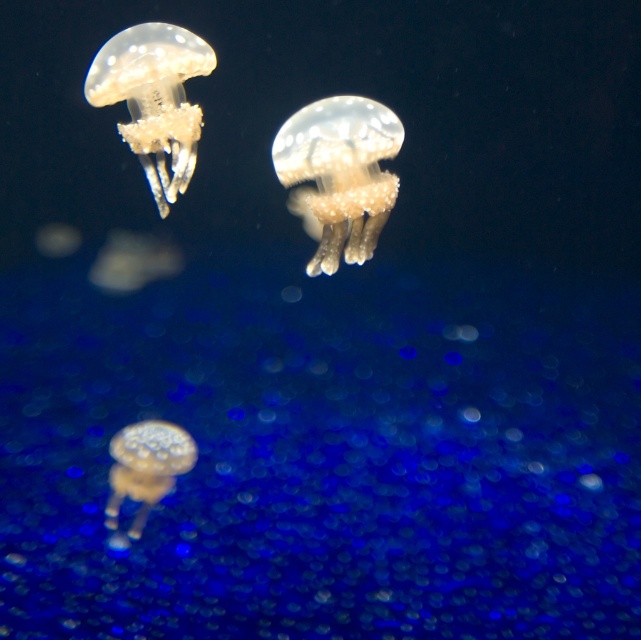
You are an underwater photographer aiming to capture the largest jellyfish in the scene. Given the translucent gelatinous at upper left and the translucent gelatinous at lower center, which one should you focus on?

The translucent gelatinous at upper left is larger in size compared to the translucent gelatinous at lower center, so you should focus on the translucent gelatinous at upper left to capture the largest jellyfish.

What are the exact coordinates of the translucent gelatinous at center in the image?

The translucent gelatinous at center is located at point (338,173).

You are an underwater photographer capturing the jellyfish. You need to adjust your camera to focus on the translucent gelatinous at upper left and the translucent gelatinous at lower center. Which one is positioned higher in the water column?

The translucent gelatinous at upper left is positioned higher in the water column than the translucent gelatinous at lower center because it is located above it.